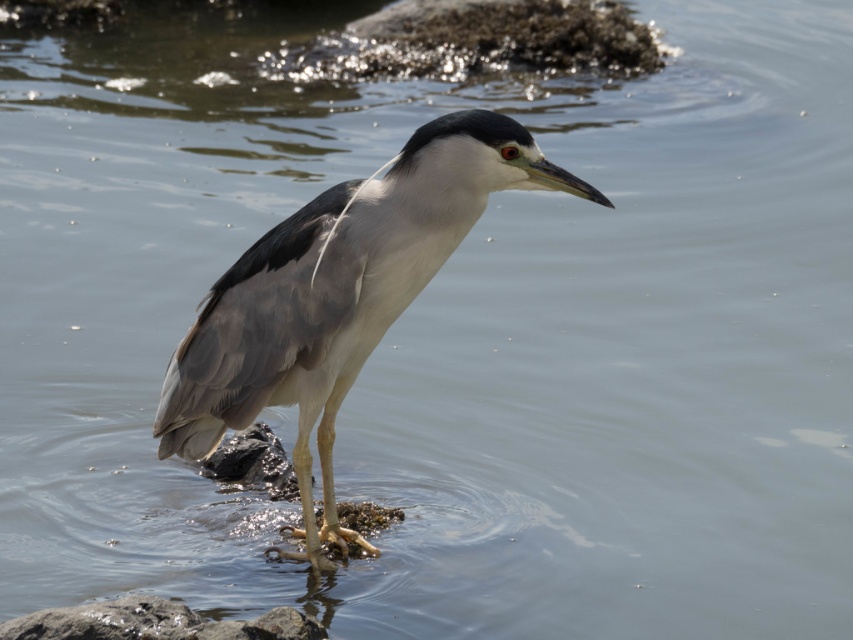
Who is more distant from viewer, [490,168] or [187,634]?

Point [490,168]

Can you confirm if gray matte bird at center is positioned below smooth gray rock at lower left?

Actually, gray matte bird at center is above smooth gray rock at lower left.

This screenshot has width=853, height=640. Find the location of `gray matte bird at center`. gray matte bird at center is located at coordinates (338, 296).